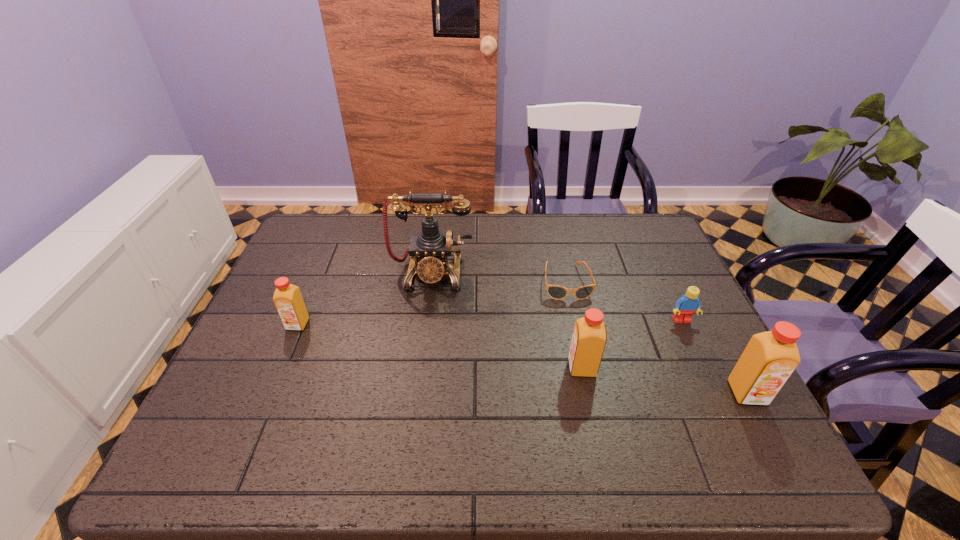
Please point a space for a new orange_juice to maintain equal intervals. Please provide its 2D coordinates. Your answer should be formatted as a tuple, i.e. [(x, y)], where the tuple contains the x and y coordinates of a point satisfying the conditions above.

[(433, 345)]